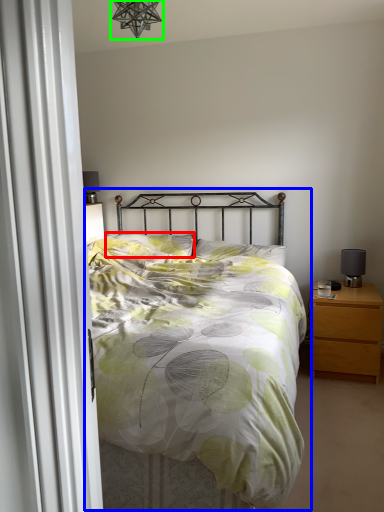
Question: Considering the real-world distances, which object is farthest from pillow (highlighted by a red box)? bed (highlighted by a blue box) or light fixture (highlighted by a green box)?

Choices:
 (A) bed
 (B) light fixture

Answer: (B)